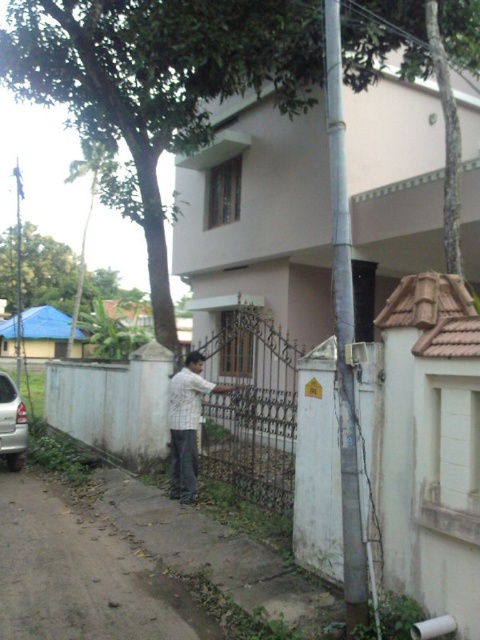
Is dirt road at lower left closer to the viewer compared to striped shirt at center?

Yes, dirt road at lower left is in front of striped shirt at center.

Can you confirm if dirt road at lower left is positioned to the left of striped shirt at center?

Indeed, dirt road at lower left is positioned on the left side of striped shirt at center.

Does point (98, 572) come behind point (188, 493)?

No, it is not.

You are a GUI agent. You are given a task and a screenshot of the screen. Output one action in this format:
    pyautogui.click(x=<x>, y=<y>)
    Task: Click on the dirt road at lower left
    Image resolution: width=480 pixels, height=640 pixels.
    Given the screenshot: What is the action you would take?
    pyautogui.click(x=82, y=573)

Which is in front, point (212, 60) or point (276, 356)?

Positioned in front is point (212, 60).

Between green leafy tree at upper left and black wrought iron gate at center, which one appears on the right side from the viewer's perspective?

black wrought iron gate at center is more to the right.

The width and height of the screenshot is (480, 640). What are the coordinates of `green leafy tree at upper left` in the screenshot? It's located at (157, 83).

At what (x,y) coordinates should I click in order to perform the action: click on green leafy tree at upper left. Please return your answer as a coordinate pair (x, y). Looking at the image, I should click on (157, 83).

Does white painted metal fence at center have a lesser width compared to black wrought iron gate at center?

No, white painted metal fence at center is not thinner than black wrought iron gate at center.

In the scene shown: Can you confirm if white painted metal fence at center is bigger than black wrought iron gate at center?

Yes.

Is point (294, 364) behind point (236, 481)?

Yes.

Find the location of a particular element. Image resolution: width=480 pixels, height=640 pixels. white painted metal fence at center is located at coordinates (252, 410).